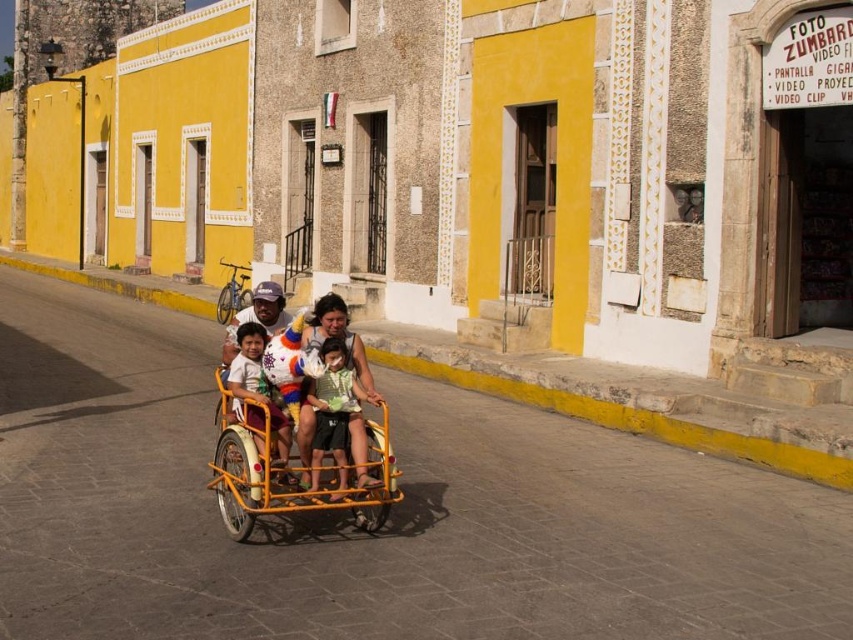
You are a tourist in this historic town and want to take a ride. You see a yellow matte wagon at center and a light brown wooden cart at center. Which one is on the right side from your perspective?

The yellow matte wagon at center is positioned on the right side of light brown wooden cart at center, so from your perspective, the yellow matte wagon at center is on the right.